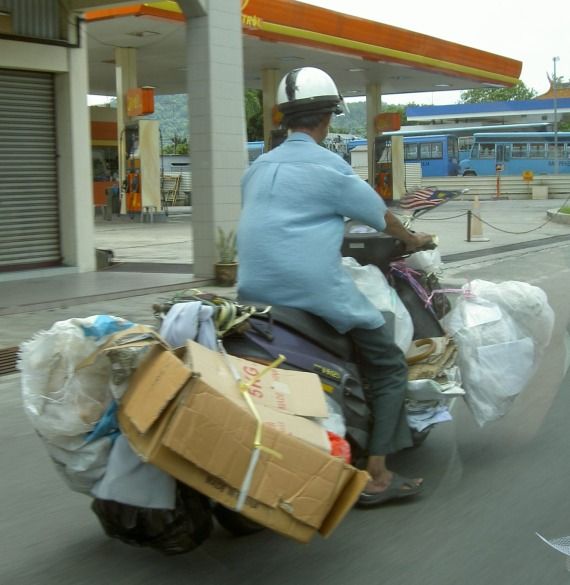
This screenshot has width=570, height=585. I want to click on cardboard boxes, so click(x=209, y=426).